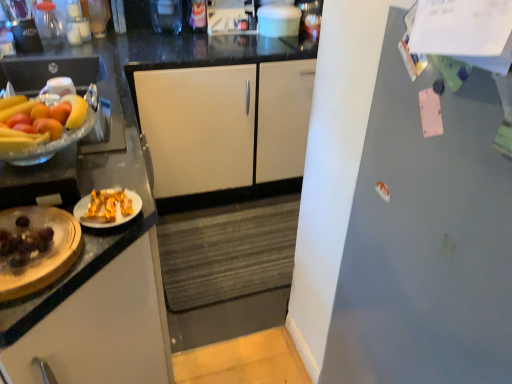
Question: Based on their sizes in the image, would you say white matte cabinet at center, which is counted as the second cabinetry, starting from the bottom, is bigger or smaller than yellow matte banana at left?

Choices:
 (A) big
 (B) small

Answer: (A)

Question: Is point (209, 180) positioned closer to the camera than point (74, 127)?

Choices:
 (A) closer
 (B) farther

Answer: (B)

Question: Considering the real-world distances, which object is farthest from the yellow matte banana at left?

Choices:
 (A) yellow matte grapefruit at left
 (B) white glossy plate at left, the first cabinetry when ordered from front to back
 (C) gray matte refrigerator at right
 (D) white matte cabinet at center, marked as the first cabinetry in a top-to-bottom arrangement
 (E) shiny brown chocolate at left

Answer: (D)

Question: Based on their relative distances, which object is farther from the gray matte refrigerator at right?

Choices:
 (A) white glossy plate at left, acting as the 1th cabinetry starting from the bottom
 (B) yellow matte grapefruit at left
 (C) shiny brown chocolate at left
 (D) yellow matte banana at left
 (E) white matte cabinet at center, which is counted as the second cabinetry, starting from the bottom

Answer: (E)